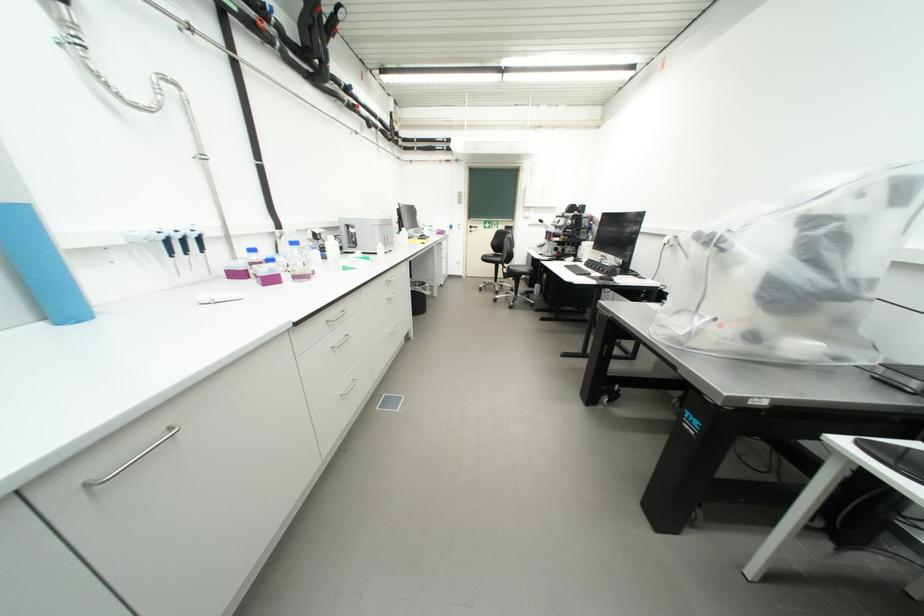
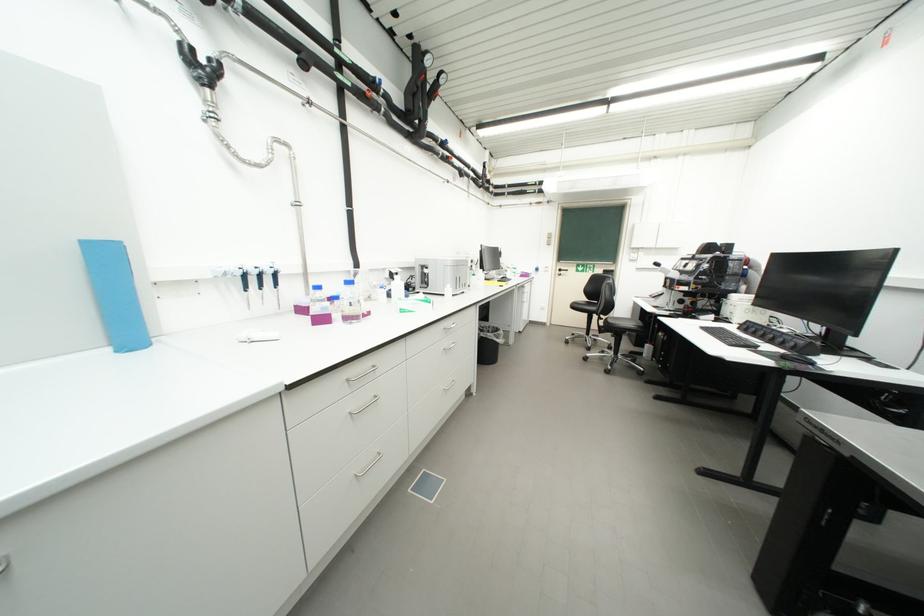
Question: The images are taken continuously from a first-person perspective. In which direction is your viewpoint rotating?

Choices:
 (A) Left
 (B) Right
 (C) Up
 (D) Down

Answer: (A)